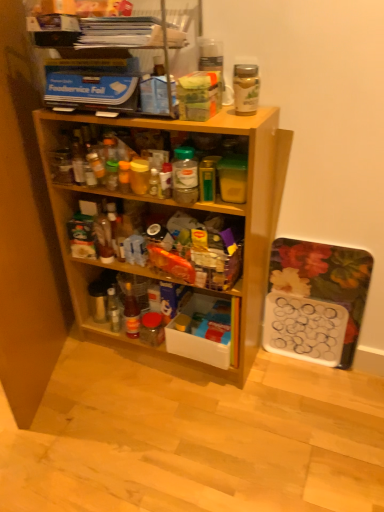
What do you see at coordinates (167, 227) in the screenshot? I see `wooden shelf at center` at bounding box center [167, 227].

Locate an element on the screen. wooden shelf at center is located at coordinates (167, 227).

Measure the distance between wooden shelf at center and camera.

The distance of wooden shelf at center from camera is 1.24 meters.

What are the coordinates of `wooden shelf at center` in the screenshot? It's located at (167, 227).